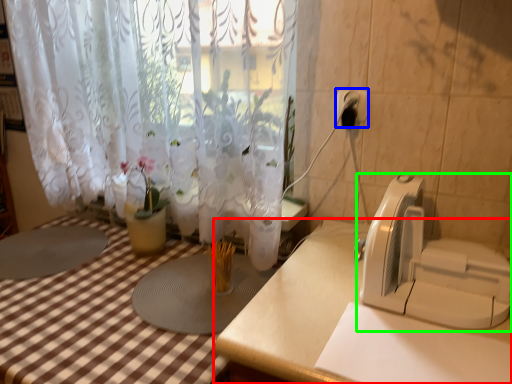
Question: Based on their relative distances, which object is nearer to table (highlighted by a red box)? Choose from electric outlet (highlighted by a blue box) and appliance (highlighted by a green box).

Choices:
 (A) electric outlet
 (B) appliance

Answer: (B)